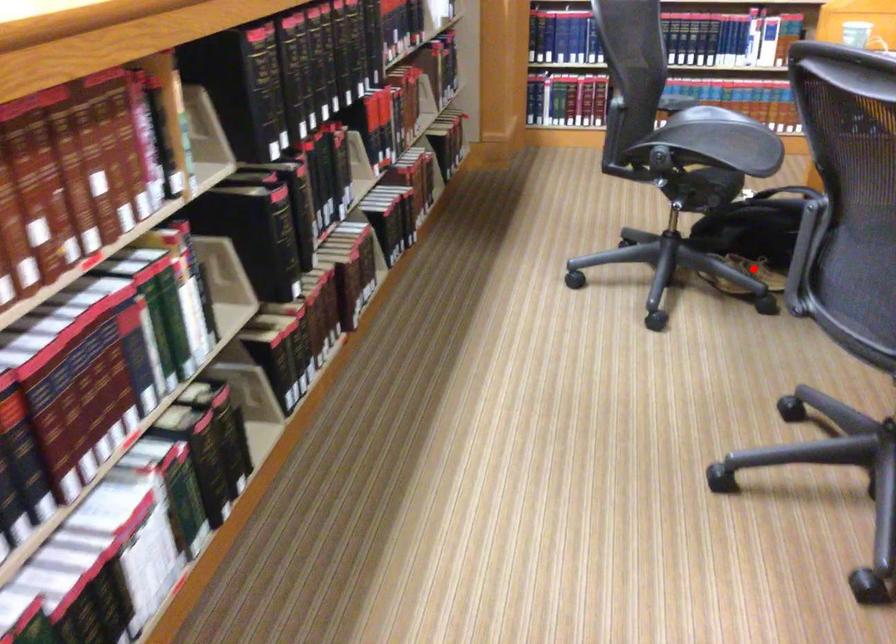
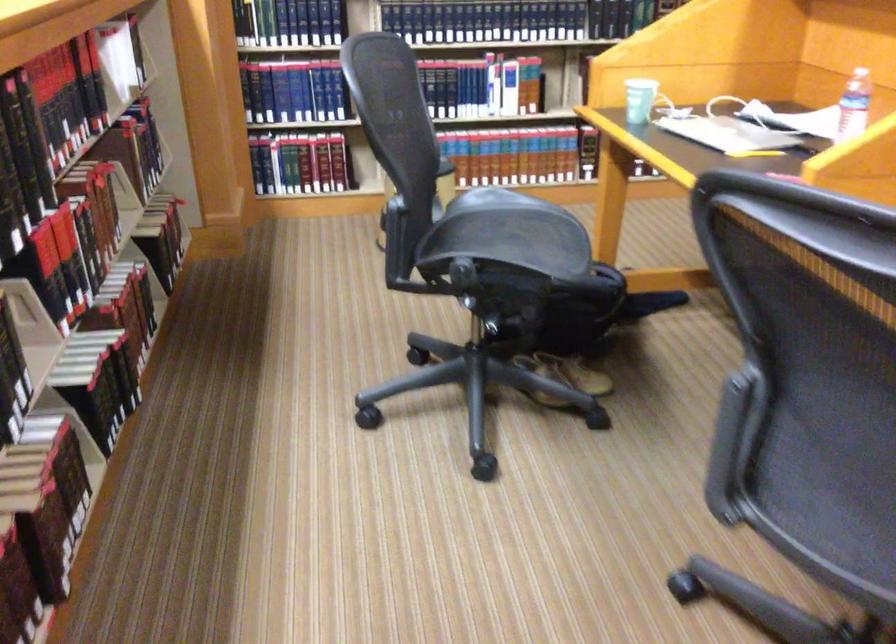
Question: I am providing you with two images of the same scene from different viewpoints. A red point is shown in image1. For the corresponding object point in image2, is it positioned nearer or farther from the camera?

Choices:
 (A) Nearer
 (B) Farther

Answer: (A)